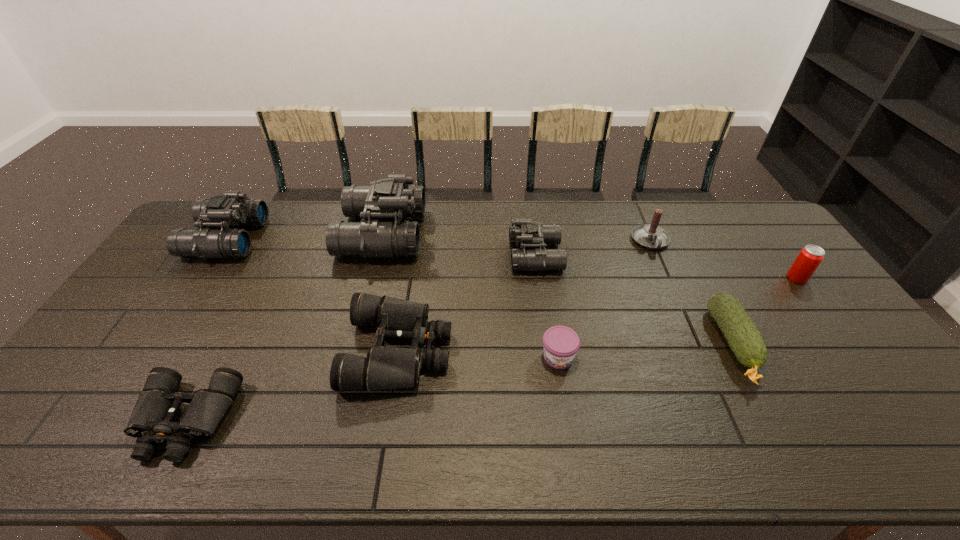
Identify the location of vacant area located 0.140m through the lenses of the rightmost blue binoculars. The width and height of the screenshot is (960, 540). (468, 255).

Find the location of a particular element. The width and height of the screenshot is (960, 540). vacant area situated on the left of the rightmost object is located at coordinates (680, 278).

The image size is (960, 540). What are the coordinates of `vacant space positioned 0.140m through the eyepieces of the bigger black binoculars` in the screenshot? It's located at (503, 350).

Where is `vacant space situated at the blossom end of the cucumber`? vacant space situated at the blossom end of the cucumber is located at coordinates (771, 417).

Locate an element on the screen. vacant position located 0.050m on the front label of the jam is located at coordinates (x=564, y=389).

This screenshot has width=960, height=540. What are the coordinates of `candle present at the far edge` in the screenshot? It's located at (651, 236).

In order to click on object that is positioned at the near edge in this screenshot , I will do `click(151, 421)`.

Find the location of `object present at the left edge`. object present at the left edge is located at coordinates (232, 209).

You are a GUI agent. You are given a task and a screenshot of the screen. Output one action in this format:
    pyautogui.click(x=<x>, y=<y>)
    Task: Click on the object situated at the right edge
    Image resolution: width=960 pixels, height=540 pixels.
    Given the screenshot: What is the action you would take?
    pyautogui.click(x=810, y=257)

This screenshot has width=960, height=540. Identify the location of object that is positioned at the far left corner. (232, 209).